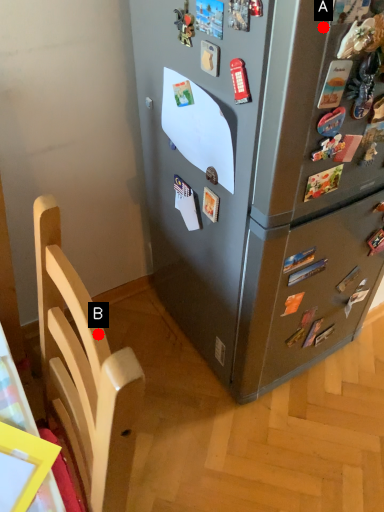
Question: Two points are circled on the image, labeled by A and B beside each circle. Which of the following is the closest to the observer?

Choices:
 (A) A is closer
 (B) B is closer

Answer: (B)